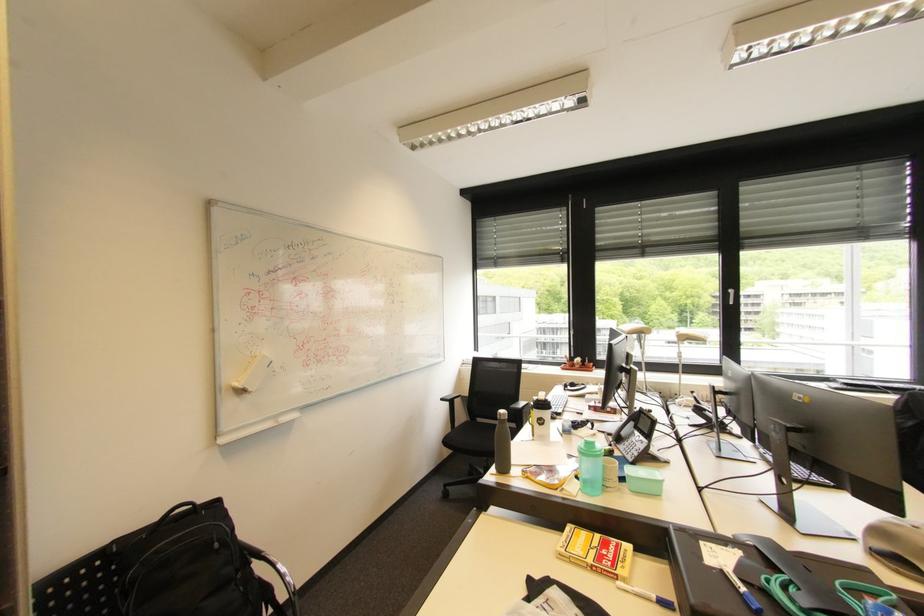
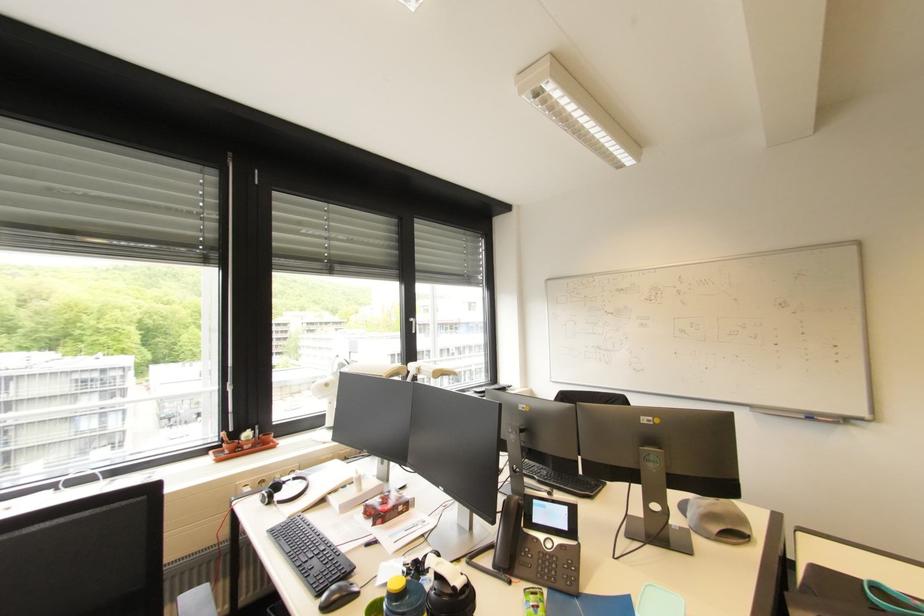
Where in the second image is the point corresponding to (x=655, y=422) from the first image?

(572, 509)